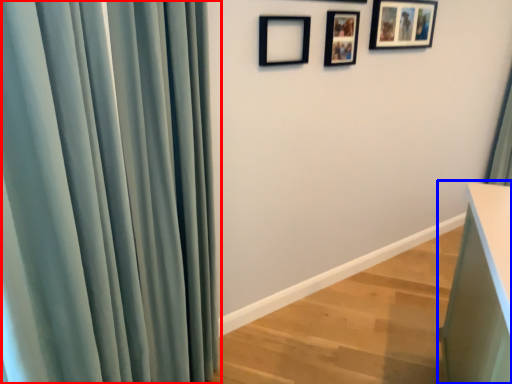
Question: Which of the following is the farthest to the observer, curtain (highlighted by a red box) or vanity (highlighted by a blue box)?

Choices:
 (A) curtain
 (B) vanity

Answer: (B)